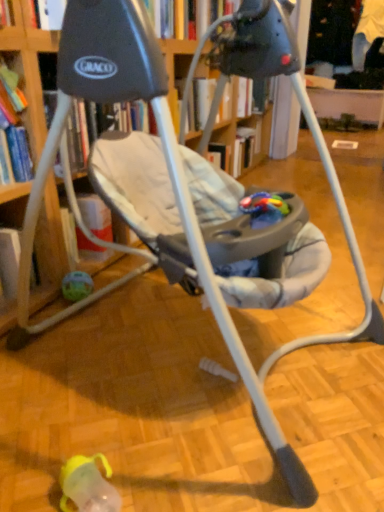
At what (x,y) coordinates should I click in order to perform the action: click on free space to the right of translucent plastic ball at lower left, the first toy in the bottom-to-top sequence. Please return your answer as a coordinate pair (x, y). The width and height of the screenshot is (384, 512). Looking at the image, I should click on (130, 298).